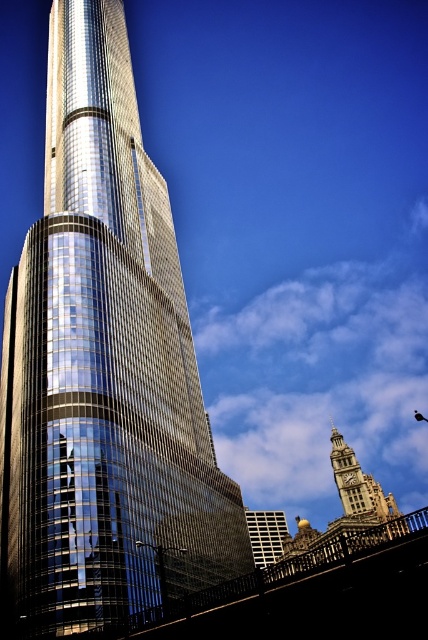
You are standing in front of the modern skyscraper and want to take a photo that includes both the modern skyscraper and the historic building with the clock tower. You notice two points marked on your camera screen at coordinates point (118, 376) and point (264, 547). Which point is closer to you?

Point (118, 376) is closer to the viewer than point (264, 547).

You are standing at the center of the image and want to locate the shiny glass skyscraper at left. According to the coordinates provided, in which direction should you look to find it?

The shiny glass skyscraper at left is located at coordinates point [103,371], which means it is positioned to the right and slightly above the center point of the image. Therefore, you should look towards the right and upwards from the center to locate it.